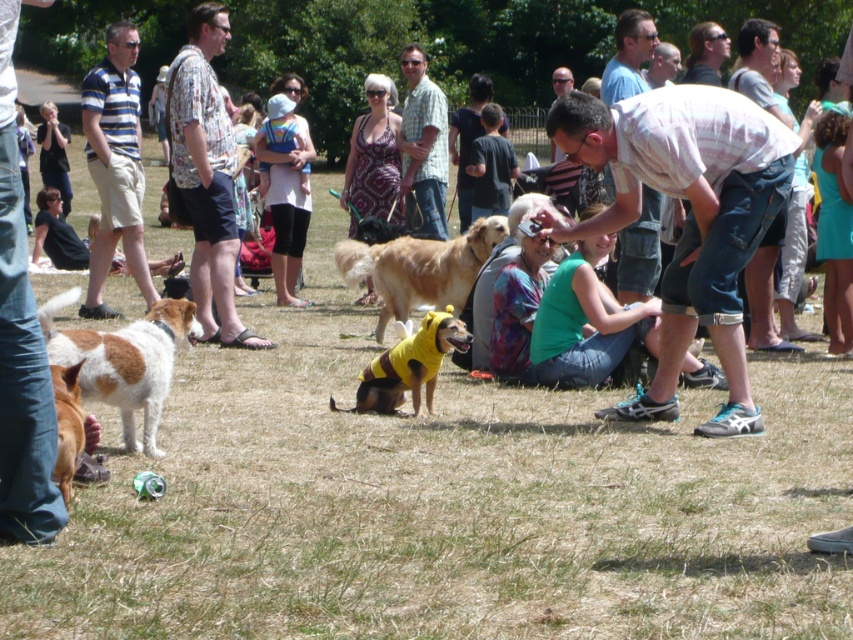
You are a photographer at the event and want to capture both the brown and white fur dog at lower left and the golden fur dog at center in a single photo. The camera you are using has a maximum focus range of 3 meters. Will you be able to include both dogs in the photo without moving closer?

The brown and white fur dog at lower left and the golden fur dog at center are 3.44 meters apart. Since the distance between them exceeds the camera maximum focus range of 3 meters, you will not be able to capture both dogs in a single photo without moving closer.

You are organizing a photo shoot and need to arrange two models wearing the striped polo shirt at left and the green plaid shirt at center. To ensure they both fit in the frame, you want to know which shirt is wider. Can you determine which one is wider?

The striped polo shirt at left might be wider than green plaid shirt at center according to the description, so it is likely the wider option for the photo shoot arrangement.

You are a photographer at the event and want to capture both the green plaid shirt at center and the brown fur dog at lower left in the same frame. Based on their positions, which object is located to the right of the other?

The green plaid shirt at center is positioned on the right side of brown fur dog at lower left, so the green plaid shirt at center is to the right of the brown fur dog at lower left.